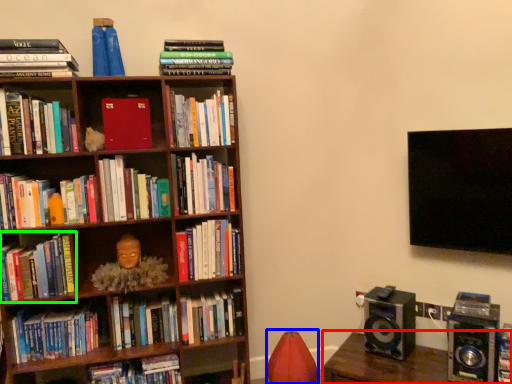
Question: Estimate the real-world distances between objects in this image. Which object is farther from furniture (highlighted by a red box), bean bag chair (highlighted by a blue box) or book (highlighted by a green box)?

Choices:
 (A) bean bag chair
 (B) book

Answer: (B)